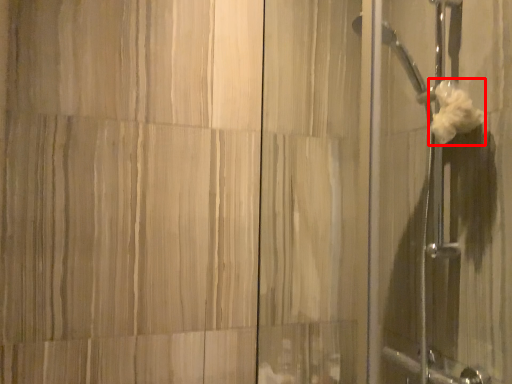
Question: From the image's perspective, considering the relative positions of flower (annotated by the red box) and screen door in the image provided, where is flower (annotated by the red box) located with respect to the staircase?

Choices:
 (A) above
 (B) below

Answer: (A)